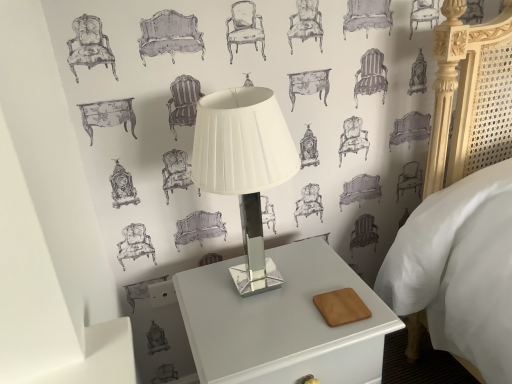
This screenshot has height=384, width=512. In order to click on vacant space underneath white glossy table lamp at center (from a real-world perspective) in this screenshot , I will do `click(263, 286)`.